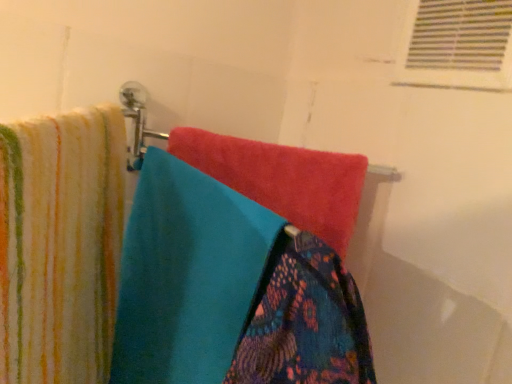
Question: Is patterned fabric towel at center, which is the first towel in right-to-left order, shorter than striped cotton towel at left, marked as the third towel in a right-to-left arrangement?

Choices:
 (A) yes
 (B) no

Answer: (A)

Question: Can we say patterned fabric towel at center, which is the third towel from left to right, lies outside striped cotton towel at left, marked as the third towel in a right-to-left arrangement?

Choices:
 (A) yes
 (B) no

Answer: (A)

Question: Is patterned fabric towel at center, which is the third towel from left to right, taller than striped cotton towel at left, marked as the third towel in a right-to-left arrangement?

Choices:
 (A) no
 (B) yes

Answer: (A)

Question: Is patterned fabric towel at center, which is the first towel in right-to-left order, positioned far away from striped cotton towel at left, marked as the third towel in a right-to-left arrangement?

Choices:
 (A) no
 (B) yes

Answer: (A)

Question: Is patterned fabric towel at center, which is the first towel in right-to-left order, looking in the opposite direction of striped cotton towel at left, which is the 1th towel from left to right?

Choices:
 (A) yes
 (B) no

Answer: (A)

Question: Visually, is patterned fabric towel at center, which is the first towel in right-to-left order, positioned to the left or to the right of white plastic vent at upper right?

Choices:
 (A) right
 (B) left

Answer: (B)

Question: From the image's perspective, is patterned fabric towel at center, which is the first towel in right-to-left order, positioned above or below white plastic vent at upper right?

Choices:
 (A) below
 (B) above

Answer: (A)

Question: Looking at the image, does patterned fabric towel at center, which is the first towel in right-to-left order, seem bigger or smaller compared to white plastic vent at upper right?

Choices:
 (A) big
 (B) small

Answer: (A)

Question: Is patterned fabric towel at center, which is the first towel in right-to-left order, spatially inside white plastic vent at upper right, or outside of it?

Choices:
 (A) outside
 (B) inside

Answer: (A)

Question: Considering their positions, is turquoise soft towel at center, positioned as the 2th towel in right-to-left order, located in front of or behind striped cotton towel at left, marked as the third towel in a right-to-left arrangement?

Choices:
 (A) front
 (B) behind

Answer: (B)

Question: Is turquoise soft towel at center, positioned as the 2th towel in right-to-left order, spatially inside striped cotton towel at left, marked as the third towel in a right-to-left arrangement, or outside of it?

Choices:
 (A) inside
 (B) outside

Answer: (B)

Question: From their relative heights in the image, would you say turquoise soft towel at center, the 2th towel from the left, is taller or shorter than striped cotton towel at left, which is the 1th towel from left to right?

Choices:
 (A) short
 (B) tall

Answer: (A)

Question: In terms of width, does turquoise soft towel at center, the 2th towel from the left, look wider or thinner when compared to striped cotton towel at left, marked as the third towel in a right-to-left arrangement?

Choices:
 (A) wide
 (B) thin

Answer: (A)

Question: Considering the relative positions of striped cotton towel at left, which is the 1th towel from left to right, and turquoise soft towel at center, the 2th towel from the left, in the image provided, is striped cotton towel at left, which is the 1th towel from left to right, to the left or to the right of turquoise soft towel at center, the 2th towel from the left,?

Choices:
 (A) left
 (B) right

Answer: (A)

Question: Is point (68, 182) closer or farther from the camera than point (135, 365)?

Choices:
 (A) closer
 (B) farther

Answer: (A)